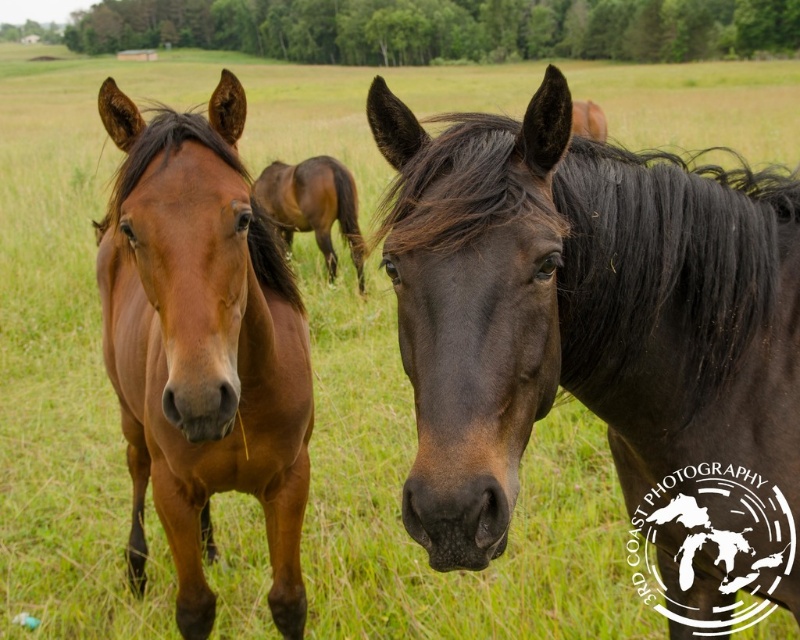
Consider the image. Does shiny dark brown horse at center have a greater height compared to brown glossy horse at center?

Incorrect, shiny dark brown horse at center's height is not larger of brown glossy horse at center's.

Which is behind, point (566, 253) or point (293, 184)?

Point (293, 184)

Is point (744, 550) closer to viewer compared to point (276, 211)?

Yes.

Find the location of a particular element. shiny dark brown horse at center is located at coordinates (598, 339).

Is the position of shiny brown horse at center less distant than that of brown glossy horse at center?

Yes, shiny brown horse at center is in front of brown glossy horse at center.

Between shiny brown horse at center and brown glossy horse at center, which one has more height?

With more height is shiny brown horse at center.

The image size is (800, 640). Identify the location of shiny brown horse at center. (202, 346).

Measure the distance between point (774, 268) and camera.

1.50 meters

Is point (770, 259) behind point (228, 236)?

Yes, point (770, 259) is behind point (228, 236).

Image resolution: width=800 pixels, height=640 pixels. What are the coordinates of `shiny dark brown horse at center` in the screenshot? It's located at (598, 339).